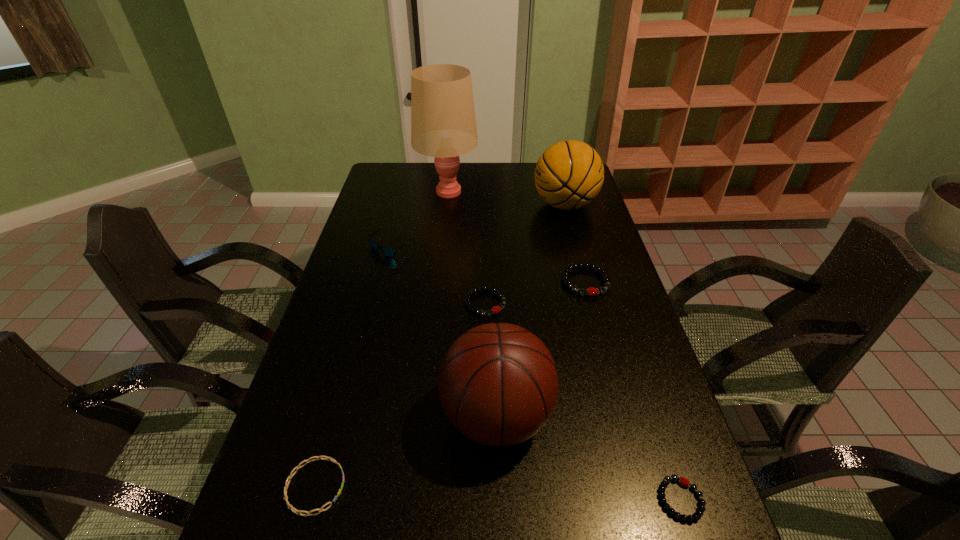
Identify the location of vacant space at the far edge of the desktop. (470, 188).

In the image, there is a desktop. Identify the location of free space at the left edge. (320, 326).

Identify the location of blank space at the right edge. This screenshot has height=540, width=960. [597, 364].

What are the coordinates of `vacant space in between the biggest black bracelet and the orange basketball` in the screenshot? It's located at (575, 244).

The width and height of the screenshot is (960, 540). Identify the location of vacant area that lies between the third shortest bracelet and the fifth tallest object. (536, 293).

The height and width of the screenshot is (540, 960). I want to click on vacant area that lies between the sixth nearest object and the blue bracelet, so click(353, 366).

This screenshot has width=960, height=540. I want to click on free space between the farther basketball and the tallest bracelet, so click(x=575, y=244).

Locate an element on the screen. The image size is (960, 540). vacant area that lies between the right basketball and the second smallest black bracelet is located at coordinates (525, 254).

What are the coordinates of `vacant area that lies between the farther basketball and the sixth tallest object` in the screenshot? It's located at (525, 254).

Locate an element on the screen. empty location between the fourth shortest object and the leftmost black bracelet is located at coordinates (536, 293).